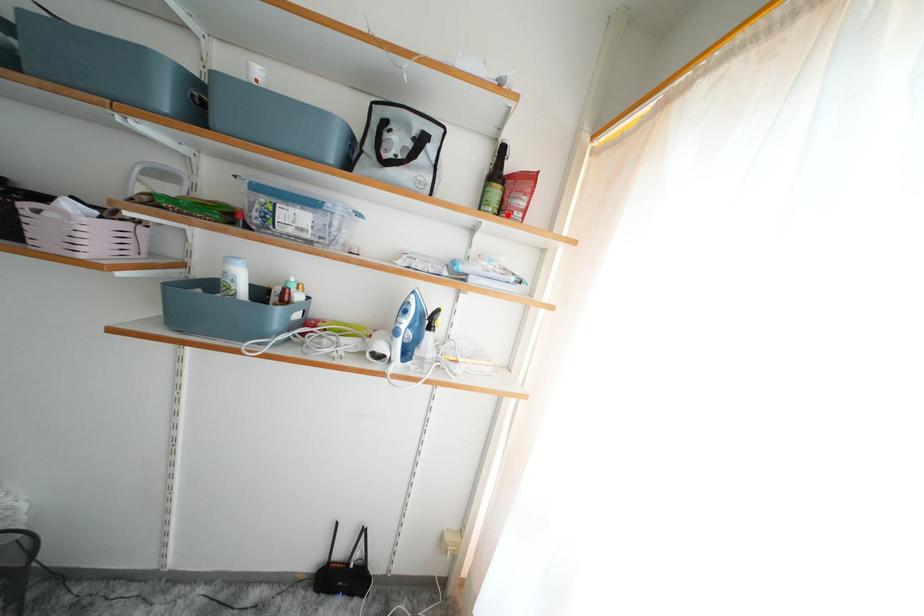
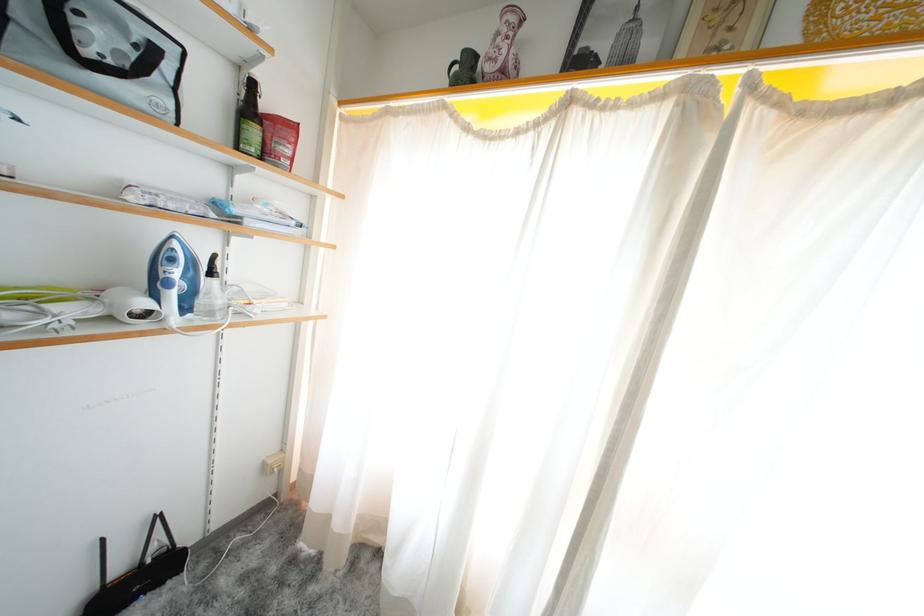
Locate, in the second image, the point that corresponds to the highlighted location in the first image.

(273, 158)